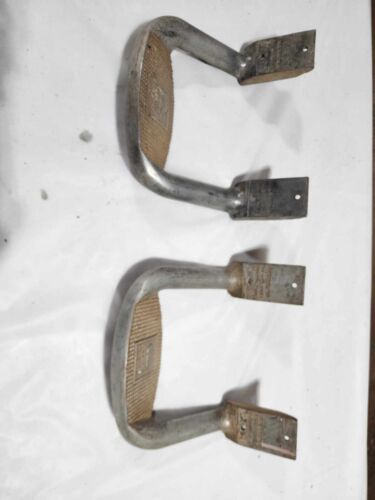
Where is `upper nail hole`? This screenshot has height=500, width=375. upper nail hole is located at coordinates (304, 49), (294, 286).